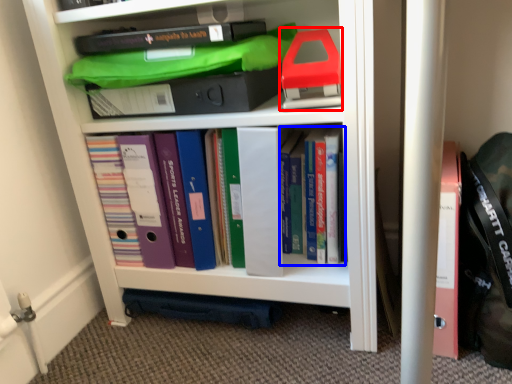
Question: Which object appears farthest to the camera in this image, book (highlighted by a red box) or book (highlighted by a blue box)?

Choices:
 (A) book
 (B) book

Answer: (B)